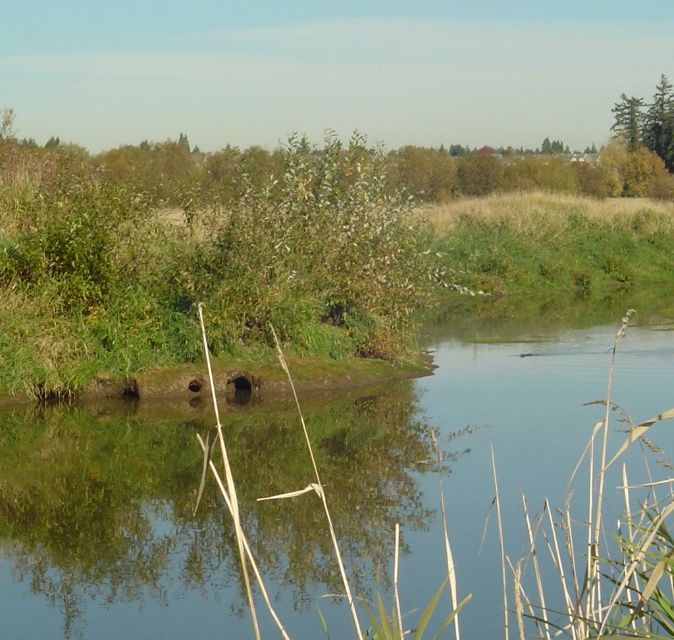
Is point (421, 497) positioned before point (612, 109)?

That is True.

Can you confirm if green grassy river at center is thinner than green leafy tree at upper right?

Incorrect, green grassy river at center's width is not less than green leafy tree at upper right's.

You are a GUI agent. You are given a task and a screenshot of the screen. Output one action in this format:
    pyautogui.click(x=<x>, y=<y>)
    Task: Click on the green grassy river at center
    The width and height of the screenshot is (674, 640).
    Given the screenshot: What is the action you would take?
    pyautogui.click(x=483, y=436)

Find the location of `green grassy river at center`. green grassy river at center is located at coordinates (483, 436).